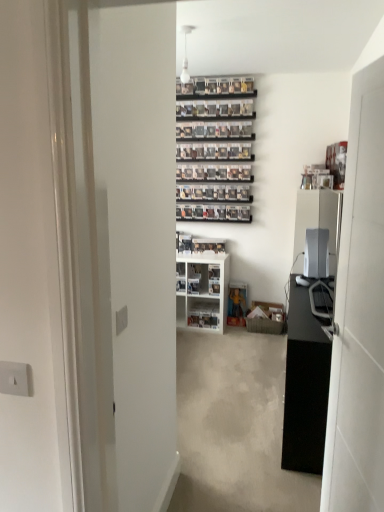
Question: Does white glossy cabinet at center appear on the right side of white glossy door at right?

Choices:
 (A) no
 (B) yes

Answer: (A)

Question: Can you confirm if white glossy cabinet at center is wider than white glossy door at right?

Choices:
 (A) no
 (B) yes

Answer: (B)

Question: Is white glossy cabinet at center directly adjacent to white glossy door at right?

Choices:
 (A) yes
 (B) no

Answer: (B)

Question: From a real-world perspective, is white glossy cabinet at center positioned under white glossy door at right based on gravity?

Choices:
 (A) yes
 (B) no

Answer: (A)

Question: Is white glossy cabinet at center facing towards white glossy door at right?

Choices:
 (A) no
 (B) yes

Answer: (B)

Question: Would you say satin silver monitor at right is inside or outside white glossy door at right?

Choices:
 (A) inside
 (B) outside

Answer: (B)

Question: Considering the positions of satin silver monitor at right and white glossy door at right in the image, is satin silver monitor at right wider or thinner than white glossy door at right?

Choices:
 (A) wide
 (B) thin

Answer: (A)

Question: Is satin silver monitor at right taller or shorter than white glossy door at right?

Choices:
 (A) tall
 (B) short

Answer: (B)

Question: Considering their positions, is satin silver monitor at right located in front of or behind white glossy door at right?

Choices:
 (A) front
 (B) behind

Answer: (B)

Question: Looking at the image, does white glossy cabinet at center seem bigger or smaller compared to white glossy door at right?

Choices:
 (A) small
 (B) big

Answer: (B)

Question: Considering their positions, is white glossy cabinet at center located in front of or behind white glossy door at right?

Choices:
 (A) behind
 (B) front

Answer: (A)

Question: From the image's perspective, relative to white glossy door at right, is white glossy cabinet at center above or below?

Choices:
 (A) above
 (B) below

Answer: (B)

Question: Based on their positions, is white glossy cabinet at center located to the left or right of white glossy door at right?

Choices:
 (A) right
 (B) left

Answer: (B)

Question: Is white glossy cabinet at center taller or shorter than white glossy shelf at center?

Choices:
 (A) tall
 (B) short

Answer: (A)

Question: From the image's perspective, relative to white glossy shelf at center, is white glossy cabinet at center above or below?

Choices:
 (A) below
 (B) above

Answer: (B)